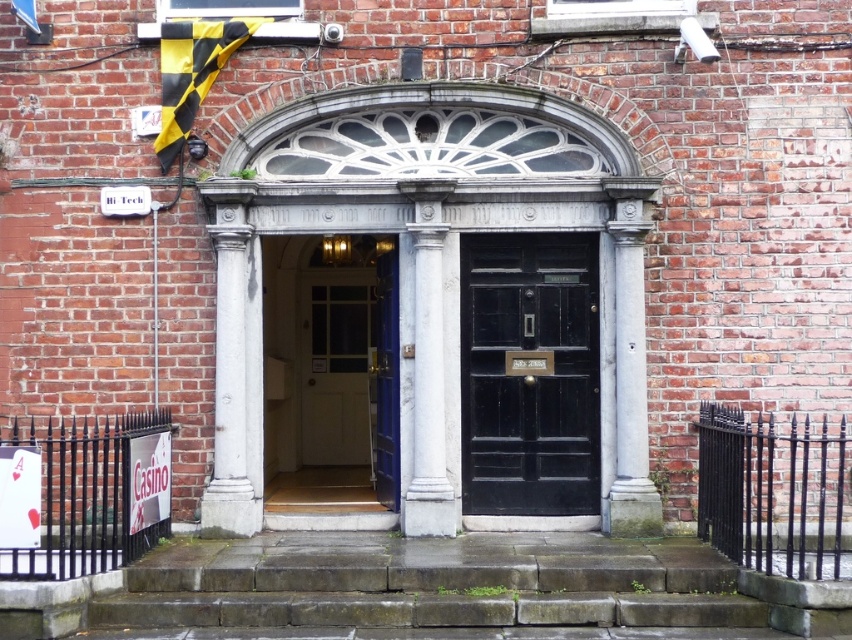
Question: Is dark grey stone steps at center positioned at the back of white wooden door at center?

Choices:
 (A) no
 (B) yes

Answer: (A)

Question: Does dark grey stone steps at center have a greater width compared to black polished wood door at center?

Choices:
 (A) yes
 (B) no

Answer: (A)

Question: Can you confirm if white wooden door at center is bigger than white stone column at center?

Choices:
 (A) yes
 (B) no

Answer: (A)

Question: Which of the following is the closest to the observer?

Choices:
 (A) black polished wood door at center
 (B) white marble column at left

Answer: (B)

Question: Which object is the farthest from the black polished wood door at center?

Choices:
 (A) white marble column at left
 (B) dark grey stone steps at center

Answer: (A)

Question: Which object appears closest to the camera in this image?

Choices:
 (A) white stone column at center
 (B) white marble column at center
 (C) white marble column at left
 (D) black polished wood door at center

Answer: (B)